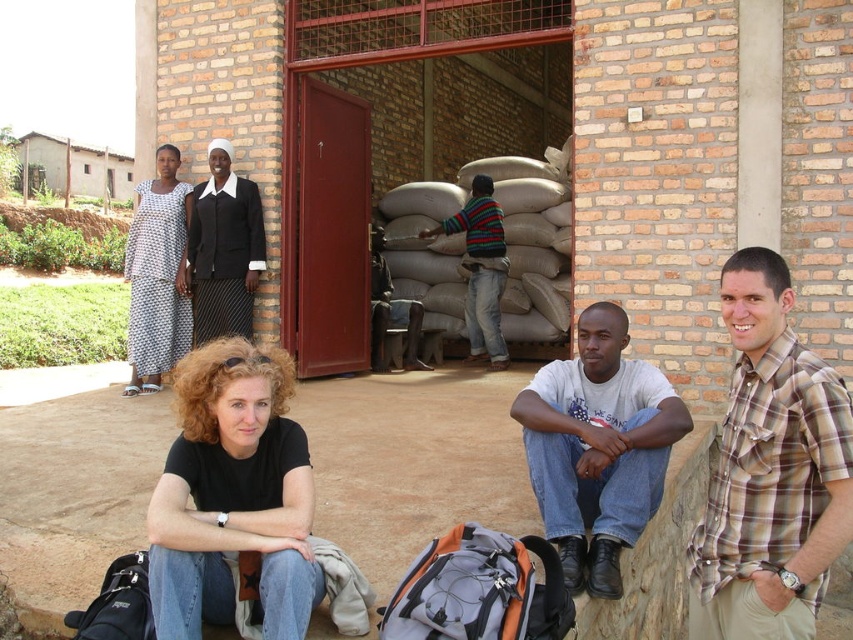
Who is taller, black fabric skirt at upper left or striped sweater at center?

striped sweater at center

Which is behind, point (254, 212) or point (498, 227)?

The point (498, 227) is more distant.

Find the location of a particular element. black fabric skirt at upper left is located at coordinates (224, 250).

Locate an element on the screen. black cotton shirt at lower left is located at coordinates (231, 496).

Does point (183, 369) come closer to viewer compared to point (183, 332)?

Yes.

At what (x,y) coordinates should I click in order to perform the action: click on black cotton shirt at lower left. Please return your answer as a coordinate pair (x, y). Image resolution: width=853 pixels, height=640 pixels. Looking at the image, I should click on (231, 496).

Is brown plaid shirt at right above black cotton shirt at lower left?

Yes, brown plaid shirt at right is above black cotton shirt at lower left.

Who is positioned more to the left, brown plaid shirt at right or black cotton shirt at lower left?

Positioned to the left is black cotton shirt at lower left.

Which is behind, point (688, 621) or point (173, 486)?

The point (688, 621) is more distant.

You are a GUI agent. You are given a task and a screenshot of the screen. Output one action in this format:
    pyautogui.click(x=<x>, y=<y>)
    Task: Click on the brown plaid shirt at right
    Image resolution: width=853 pixels, height=640 pixels.
    Given the screenshot: What is the action you would take?
    pyautogui.click(x=770, y=470)